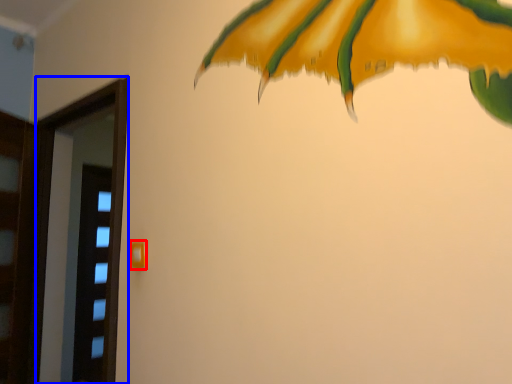
Question: Which object appears closest to the camera in this image, door handle (highlighted by a red box) or screen door (highlighted by a blue box)?

Choices:
 (A) door handle
 (B) screen door

Answer: (A)